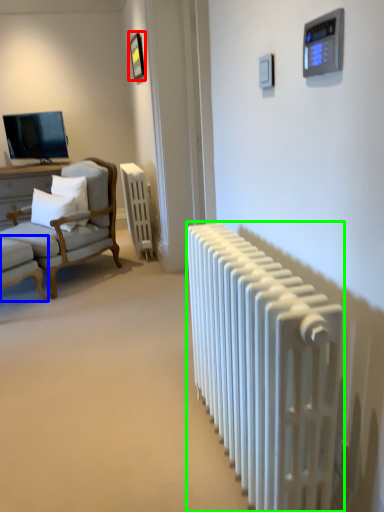
Question: Which is farther away from picture frame (highlighted by a red box)? chair (highlighted by a blue box) or radiator (highlighted by a green box)?

Choices:
 (A) chair
 (B) radiator

Answer: (B)